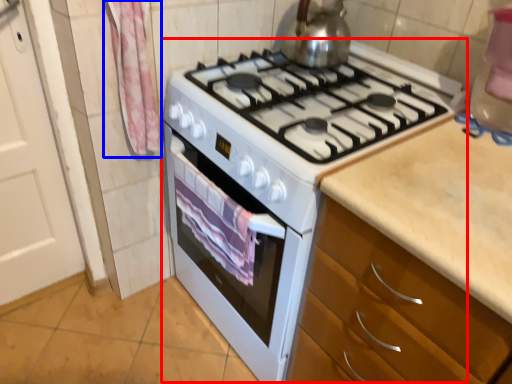
Question: Which object appears closest to the camera in this image, appliance (highlighted by a red box) or curtain (highlighted by a blue box)?

Choices:
 (A) appliance
 (B) curtain

Answer: (A)